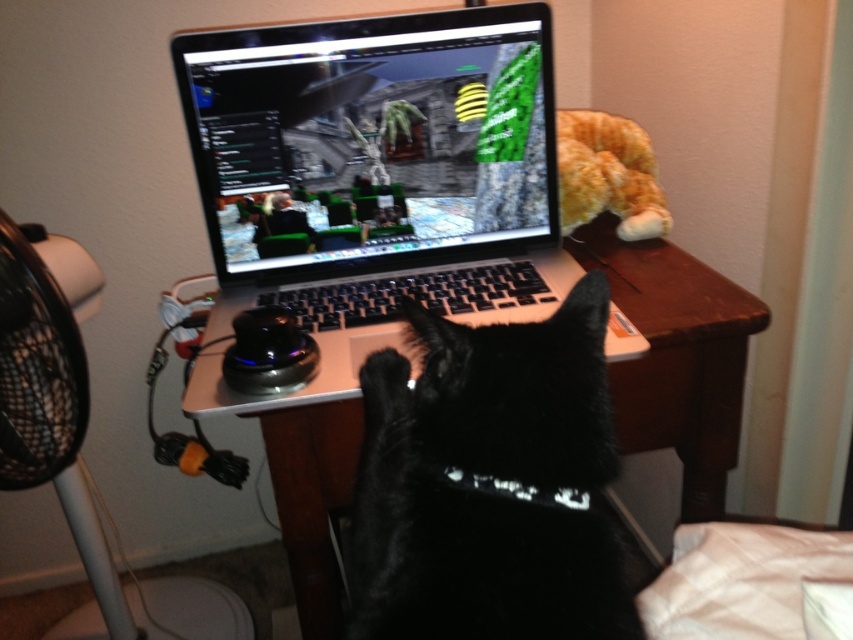
Can you confirm if black fur cat at center is positioned above white wood computer desk at center?

No.

Does black fur cat at center lie in front of white wood computer desk at center?

Yes, it is in front of white wood computer desk at center.

Between point (598, 468) and point (682, 275), which one is positioned in front?

Point (598, 468) is in front.

This screenshot has height=640, width=853. I want to click on black fur cat at center, so click(489, 483).

Between white wood computer desk at center and black plastic fan at left, which one has less height?

With less height is white wood computer desk at center.

Based on the photo, measure the distance between point [579,234] and camera.

Point [579,234] and camera are 4.25 feet apart.

Does point (708, 404) lie behind point (68, 497)?

No, (708, 404) is in front of (68, 497).

Locate an element on the screen. The image size is (853, 640). white wood computer desk at center is located at coordinates (677, 356).

Is black fur cat at center shorter than black plastic fan at left?

Yes.

Which is below, black fur cat at center or black plastic fan at left?

black plastic fan at left is below.

Is point (519, 492) less distant than point (39, 355)?

Yes, it is in front of point (39, 355).

I want to click on black fur cat at center, so click(489, 483).